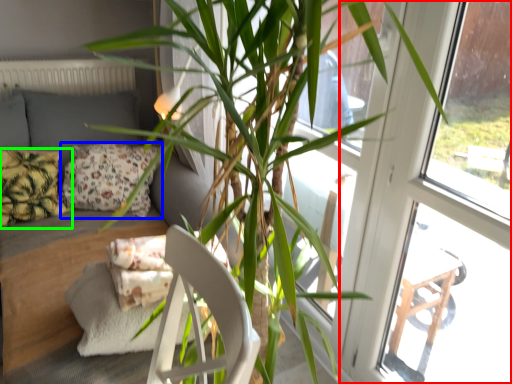
Question: Which object is positioned farthest from screen door (highlighted by a red box)? Select from pillow (highlighted by a blue box) and pillow (highlighted by a green box).

Choices:
 (A) pillow
 (B) pillow

Answer: (B)